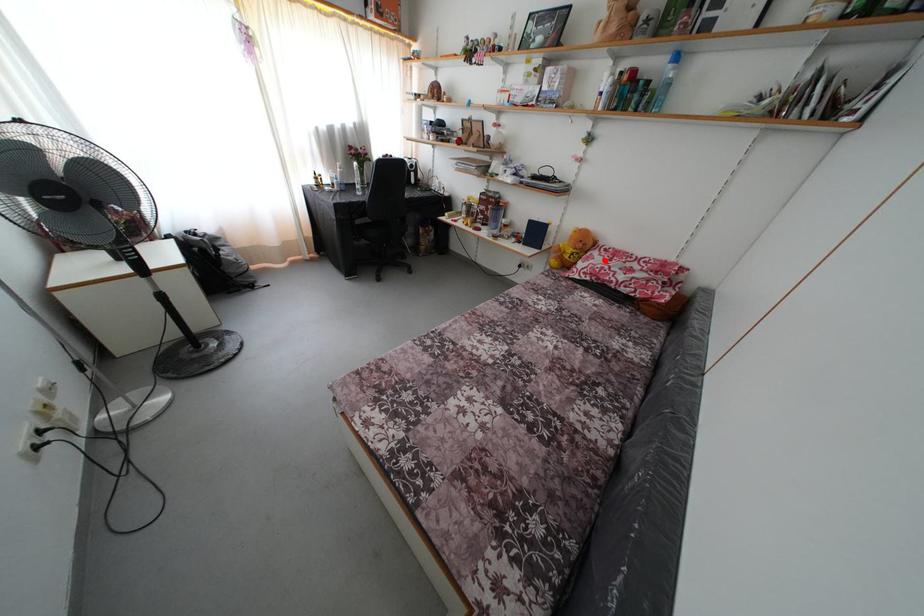
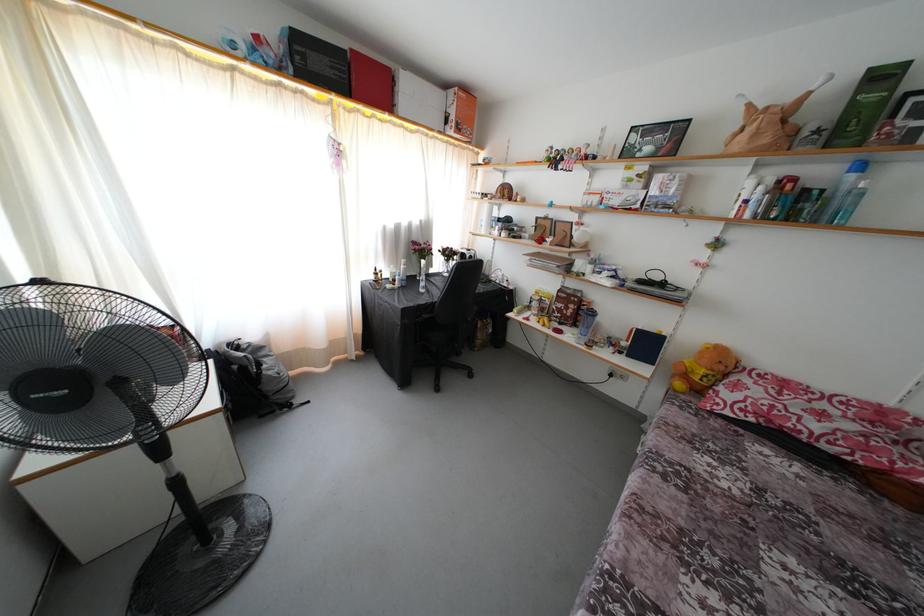
Where in the second image is the point corresponding to the highlighted location from the first image?

(760, 389)